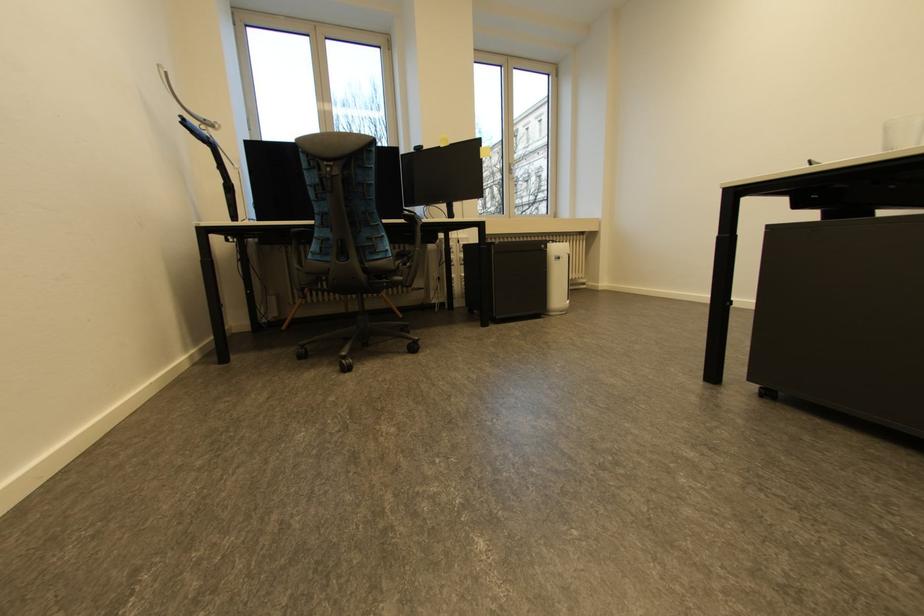
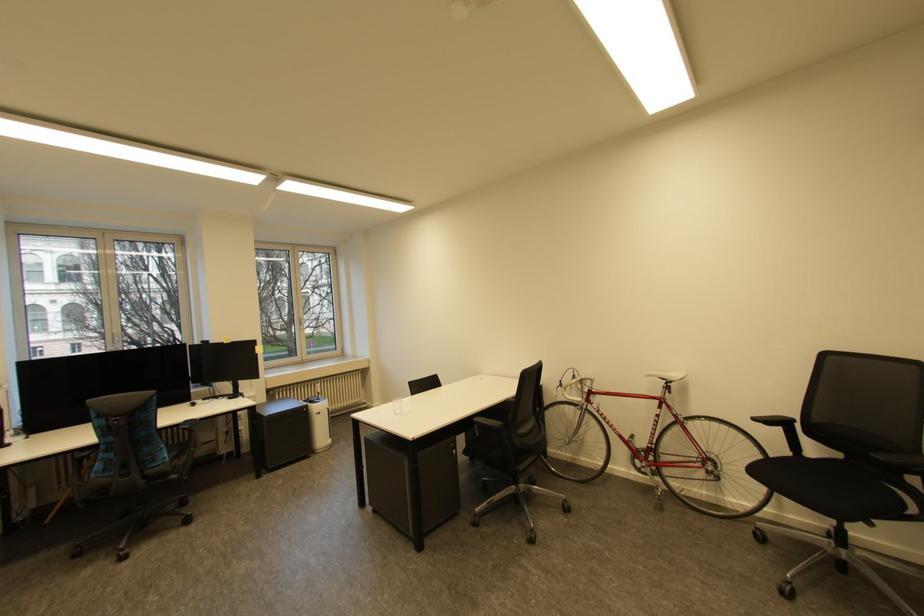
Question: What movement of the cameraman would produce the second image?

Choices:
 (A) Left
 (B) Right
 (C) Forward
 (D) Backward

Answer: (D)